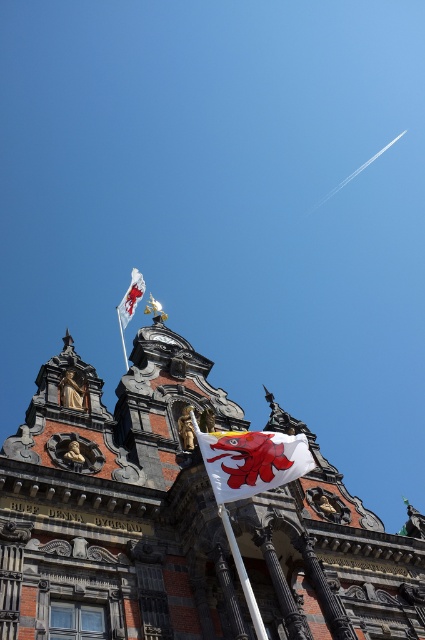
Question: Considering the real-world distances, which object is farthest from the white plastic flag pole at upper center?

Choices:
 (A) white fabric flag at upper center
 (B) dark stone tower at center

Answer: (B)

Question: Is white fabric flag at center to the left of white fabric flag at upper center from the viewer's perspective?

Choices:
 (A) yes
 (B) no

Answer: (B)

Question: Can you confirm if white fabric flag at center is thinner than white glossy flag pole at lower center?

Choices:
 (A) no
 (B) yes

Answer: (A)

Question: Is dark stone tower at center further to camera compared to white plastic flag pole at upper center?

Choices:
 (A) no
 (B) yes

Answer: (A)

Question: Which of the following is the farthest from the observer?

Choices:
 (A) white plastic flag pole at upper center
 (B) dark stone tower at center
 (C) white fabric flag at center
 (D) white glossy flag pole at lower center

Answer: (A)

Question: Which object appears farthest from the camera in this image?

Choices:
 (A) white fabric flag at center
 (B) dark stone tower at center
 (C) white glossy flag pole at lower center

Answer: (A)